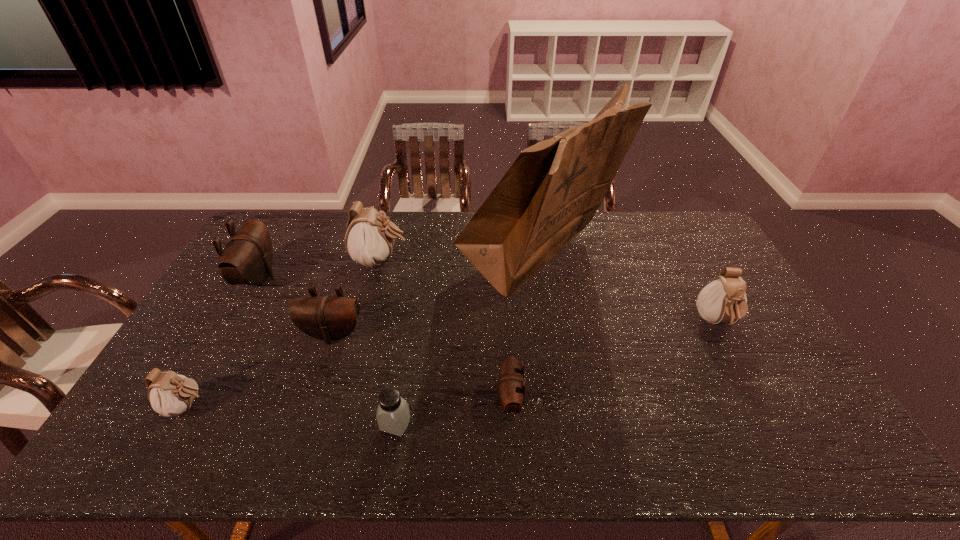
Where is `free space between the second nearest white pouch and the farthest white pouch`? free space between the second nearest white pouch and the farthest white pouch is located at coordinates (548, 292).

At what (x,y) coordinates should I click in order to perform the action: click on vacant point located between the rightmost pouch and the leftmost brown pouch. Please return your answer as a coordinate pair (x, y). This screenshot has width=960, height=540. Looking at the image, I should click on (487, 300).

Find the location of a particular element. unoccupied position between the fifth pouch from left to right and the rightmost pouch is located at coordinates [612, 362].

Identify the location of the third closest object to the nearest white pouch. Image resolution: width=960 pixels, height=540 pixels. (393, 415).

Identify which object is the third closest to the biggest brown pouch. Please provide its 2D coordinates. Your answer should be formatted as a tuple, i.e. [(x, y)], where the tuple contains the x and y coordinates of a point satisfying the conditions above.

[(170, 394)]

Locate which pouch ranks second in proximity to the leftmost brown pouch. Please provide its 2D coordinates. Your answer should be formatted as a tuple, i.e. [(x, y)], where the tuple contains the x and y coordinates of a point satisfying the conditions above.

[(369, 240)]

Identify which pouch is the third closest to the biggest white pouch. Please provide its 2D coordinates. Your answer should be formatted as a tuple, i.e. [(x, y)], where the tuple contains the x and y coordinates of a point satisfying the conditions above.

[(170, 394)]

Find the location of `white pouch that can be found as the closest to the saltshaker`. white pouch that can be found as the closest to the saltshaker is located at coordinates (170, 394).

Identify the location of the closest white pouch to the second white pouch from right to left. (170, 394).

Locate which brown pouch ranks in proximity to the leftmost white pouch. Please provide its 2D coordinates. Your answer should be formatted as a tuple, i.e. [(x, y)], where the tuple contains the x and y coordinates of a point satisfying the conditions above.

[(328, 318)]